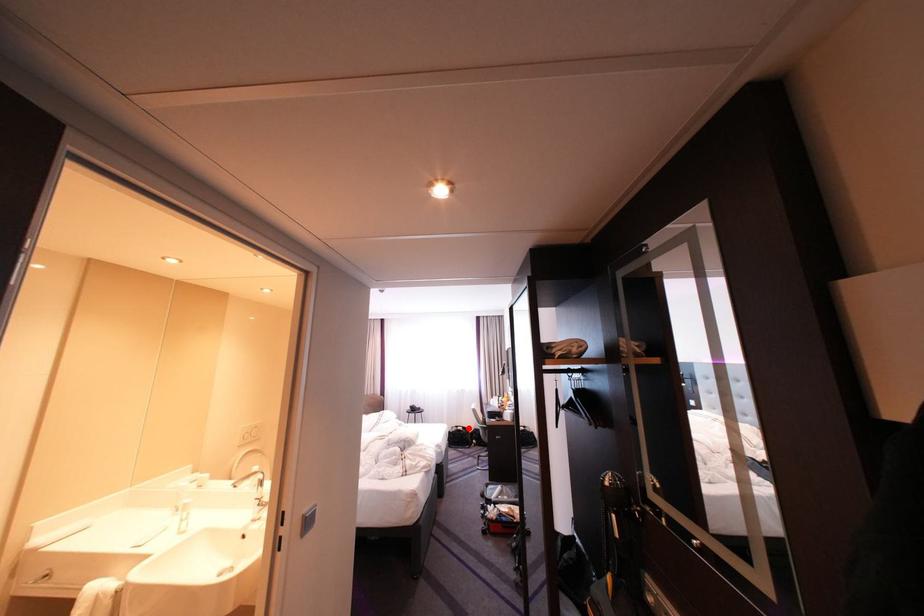
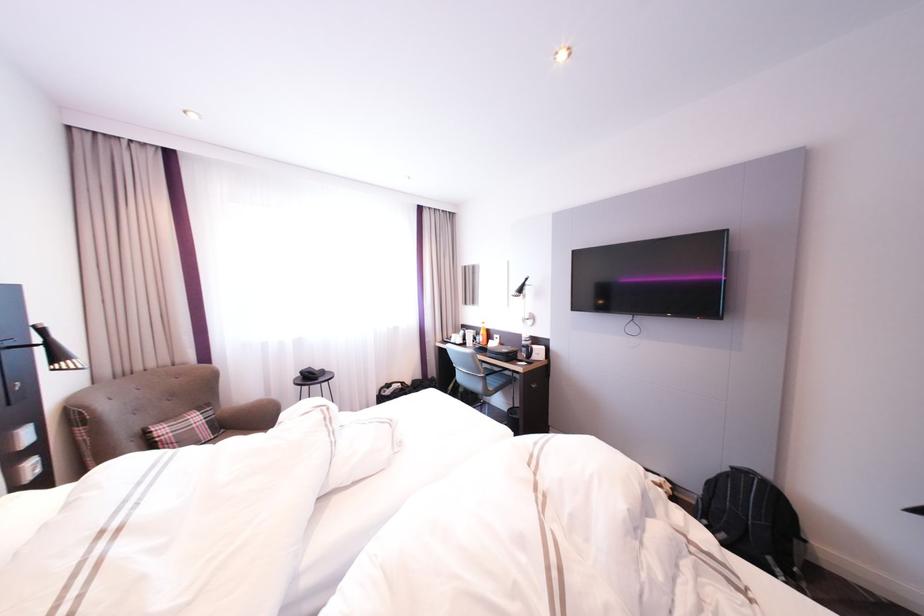
Find the pixel in the second image that matches the highlighted location in the first image.

(400, 386)